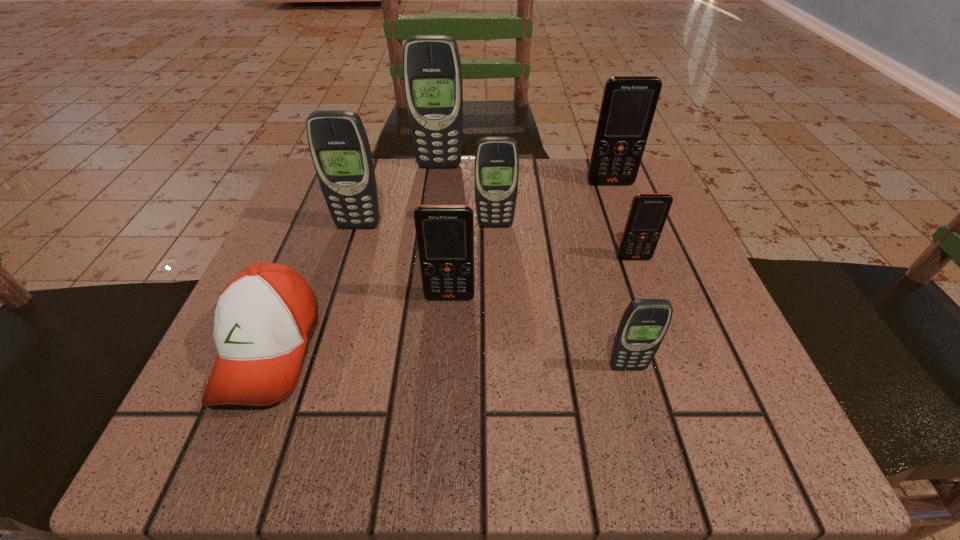
This screenshot has width=960, height=540. Identify the location of the tallest cellular telephone. (432, 73).

Locate an element on the screen. the second gray cellular telephone from left to right is located at coordinates (432, 73).

This screenshot has width=960, height=540. Identify the location of the biggest orange cellular telephone. (628, 106).

Locate an element on the screen. This screenshot has width=960, height=540. the farthest orange cellular telephone is located at coordinates (628, 106).

You are a GUI agent. You are given a task and a screenshot of the screen. Output one action in this format:
    pyautogui.click(x=<x>, y=<y>)
    Task: Click on the leftmost gray cellular telephone
    The height and width of the screenshot is (540, 960).
    Given the screenshot: What is the action you would take?
    pyautogui.click(x=339, y=146)

Identify the location of the third smallest gray cellular telephone. (339, 146).

What are the coordinates of `the second gray cellular telephone from right to left` in the screenshot? It's located at (496, 170).

The width and height of the screenshot is (960, 540). Identify the location of the leftmost orange cellular telephone. (445, 233).

Where is `the second smallest orange cellular telephone`? the second smallest orange cellular telephone is located at coordinates (445, 233).

Where is `the third nearest cellular telephone`? the third nearest cellular telephone is located at coordinates (648, 212).